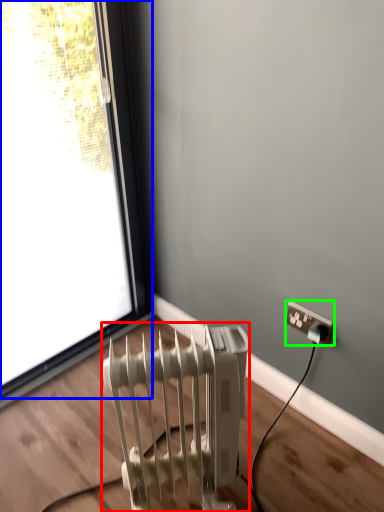
Question: Which is farther away from radiator (highlighted by a red box)? window (highlighted by a blue box) or power plugs and sockets (highlighted by a green box)?

Choices:
 (A) window
 (B) power plugs and sockets

Answer: (A)